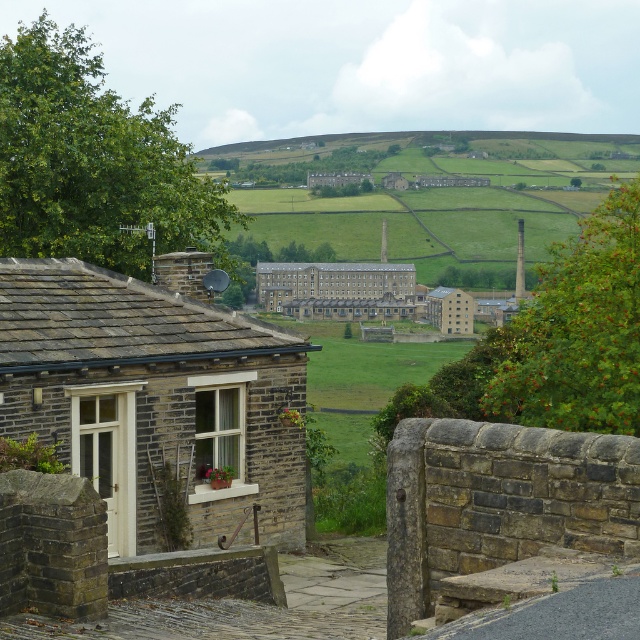
Question: Where is brown brick cottage at lower left located in relation to brown stone building at center in the image?

Choices:
 (A) below
 (B) above

Answer: (A)

Question: Which point is closer to the camera?

Choices:
 (A) brown brick cottage at lower left
 (B) brown stone building at center

Answer: (A)

Question: Among these points, which one is nearest to the camera?

Choices:
 (A) (448, 289)
 (B) (84, 307)

Answer: (B)

Question: Is brown brick cottage at lower left bigger than brown stone building at center?

Choices:
 (A) no
 (B) yes

Answer: (A)

Question: Does brown brick cottage at lower left appear over brown stone building at center?

Choices:
 (A) yes
 (B) no

Answer: (B)